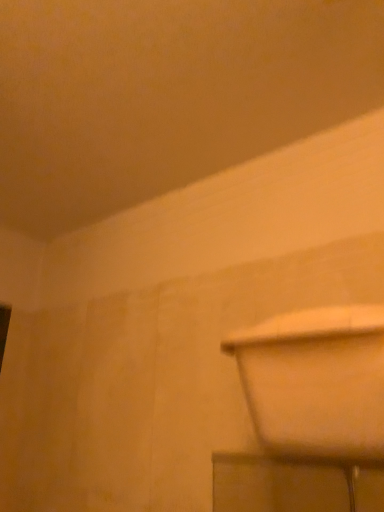
This screenshot has height=512, width=384. Describe the element at coordinates (316, 380) in the screenshot. I see `white matte bathtub at lower right` at that location.

In order to face white matte bathtub at lower right, should I rotate leftwards or rightwards?

Turn right approximately 17.081 degrees to face it.

The width and height of the screenshot is (384, 512). I want to click on white matte bathtub at lower right, so click(x=316, y=380).

Locate an element on the screen. This screenshot has width=384, height=512. white matte bathtub at lower right is located at coordinates (316, 380).